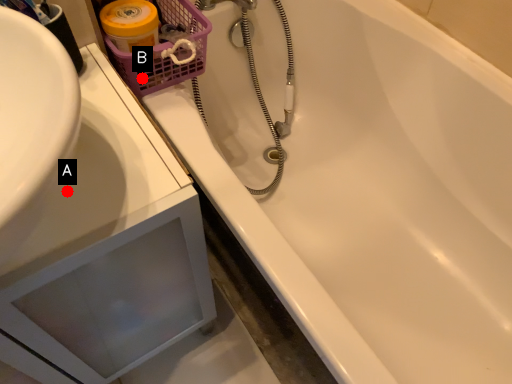
Question: Two points are circled on the image, labeled by A and B beside each circle. Which point is farther from the camera taking this photo?

Choices:
 (A) A is further
 (B) B is further

Answer: (B)